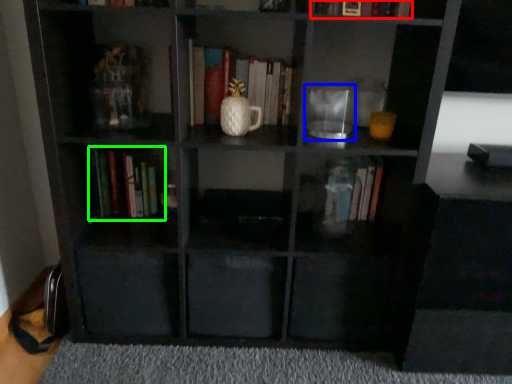
Question: Estimate the real-world distances between objects in this image. Which object is farther from book (highlighted by a red box), glass jar (highlighted by a blue box) or book (highlighted by a green box)?

Choices:
 (A) glass jar
 (B) book

Answer: (B)